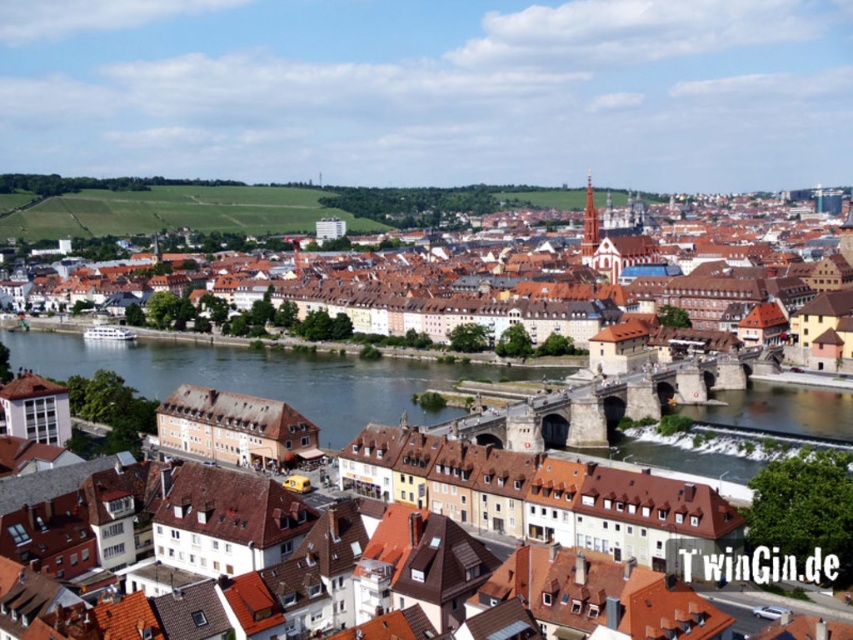
Between point (840, 328) and point (380, 372), which one is positioned in front?

Positioned in front is point (840, 328).

Does point (405, 275) come in front of point (247, 362)?

No, it is behind (247, 362).

Image resolution: width=853 pixels, height=640 pixels. Identify the location of brown/wooden townhouses at center. (491, 296).

Who is more forward, [712,484] or [422,372]?

Point [712,484]

Can you confirm if blue water at center is thinner than smooth concrete river at center?

Incorrect, blue water at center's width is not less than smooth concrete river at center's.

You are a GUI agent. You are given a task and a screenshot of the screen. Output one action in this format:
    pyautogui.click(x=<x>, y=<y>)
    Task: Click on the blue water at center
    The width and height of the screenshot is (853, 640).
    Given the screenshot: What is the action you would take?
    pyautogui.click(x=267, y=376)

This screenshot has width=853, height=640. Identify the location of blue water at center. (267, 376).

Does brown/wooden townhouses at center appear over blue water at center?

Yes, brown/wooden townhouses at center is above blue water at center.

Is point (54, 307) closer to viewer compared to point (766, 392)?

No, (54, 307) is behind (766, 392).

Is point (366, 323) farther from camera compared to point (229, 371)?

That is True.

Locate an element on the screen. brown/wooden townhouses at center is located at coordinates (491, 296).